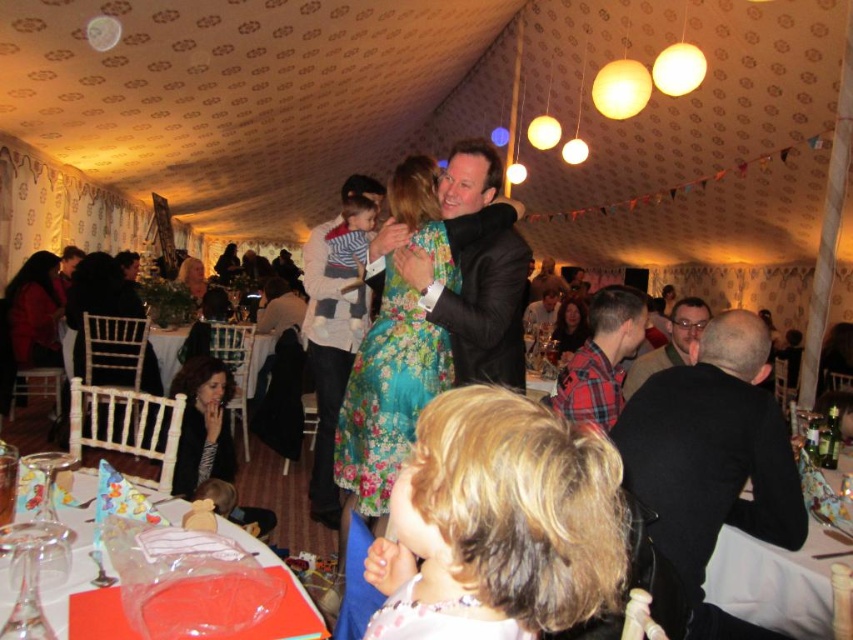
You are a photographer at the wedding reception and want to capture both the floral fabric dress at center and the floral dress at center in a single shot. Which dress should you focus on first to ensure both are in clear view?

The floral fabric dress at center is closer to the viewer than the floral dress at center, so focusing on the closer one first will help ensure both are in clear view.

You are a guest at the wedding reception and notice the transparent plastic bag at lower center and the black textured jacket at lower left. Which item is positioned higher in the scene?

The transparent plastic bag at lower center is above the black textured jacket at lower left, so it is positioned higher in the scene.